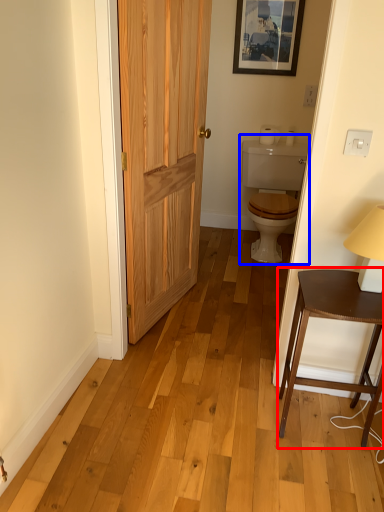
Question: Which point is closer to the camera, table (highlighted by a red box) or sink (highlighted by a blue box)?

Choices:
 (A) table
 (B) sink

Answer: (A)